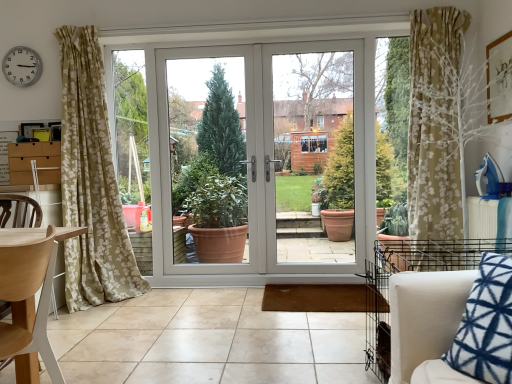
At what (x,y) coordinates should I click in order to perform the action: click on white plastic door at center, the first window frame positioned from the right. Please return your answer as a coordinate pair (x, y). Image resolution: width=512 pixels, height=384 pixels. Looking at the image, I should click on (313, 156).

In order to click on white plastic door at center, the 2th window frame positioned from the right in this screenshot , I will do `click(212, 152)`.

Describe the element at coordinates (440, 330) in the screenshot. I see `beige fabric armchair at lower right` at that location.

At what (x,y) coordinates should I click in order to perform the action: click on white glossy door at center. Please return your answer as a coordinate pair (x, y). The height and width of the screenshot is (384, 512). Looking at the image, I should click on (267, 152).

Where is `white plastic door at center, arranged as the second window frame when viewed from the left`? This screenshot has width=512, height=384. white plastic door at center, arranged as the second window frame when viewed from the left is located at coordinates (313, 156).

From the image's perspective, is beige fabric armchair at lower right located beneath white glossy door at center?

Indeed, from the image's perspective, beige fabric armchair at lower right is shown beneath white glossy door at center.

From a real-world perspective, is beige fabric armchair at lower right above or below white glossy door at center?

beige fabric armchair at lower right is below white glossy door at center.

Looking at this image, what's the angular difference between beige fabric armchair at lower right and white glossy door at center's facing directions?

89 degrees separate the facing orientations of beige fabric armchair at lower right and white glossy door at center.

Is beige fabric armchair at lower right further to camera compared to white glossy door at center?

That is False.

From a real-world perspective, is white plastic door at center, the 1th window frame in the left-to-right sequence, physically located above or below beige fabric armchair at lower right?

Clearly, from a real-world perspective, white plastic door at center, the 1th window frame in the left-to-right sequence, is above beige fabric armchair at lower right.

Consider the image. Considering the relative sizes of white plastic door at center, the 2th window frame positioned from the right, and beige fabric armchair at lower right in the image provided, is white plastic door at center, the 2th window frame positioned from the right, shorter than beige fabric armchair at lower right?

In fact, white plastic door at center, the 2th window frame positioned from the right, may be taller than beige fabric armchair at lower right.

Is white plastic door at center, the 2th window frame positioned from the right, bigger than beige fabric armchair at lower right?

Incorrect, white plastic door at center, the 2th window frame positioned from the right, is not larger than beige fabric armchair at lower right.

Based on the photo, would you say white plastic door at center, the 2th window frame positioned from the right, is inside or outside beige fabric armchair at lower right?

The correct answer is: outside.

Does beige tile at center turn towards silver metallic clock at upper left?

No, beige tile at center is not oriented towards silver metallic clock at upper left.

Between beige tile at center and silver metallic clock at upper left, which one has smaller size?

silver metallic clock at upper left is smaller.

Which is behind, beige tile at center or silver metallic clock at upper left?

silver metallic clock at upper left is further from the camera.

Between beige tile at center and silver metallic clock at upper left, which one has smaller width?

silver metallic clock at upper left.

Looking at this image, between wooden picture frame at upper right and silver metallic clock at upper left, which one is positioned in front?

wooden picture frame at upper right.

Considering the positions of point (492, 56) and point (7, 56), is point (492, 56) closer or farther from the camera than point (7, 56)?

Point (492, 56).

Can you confirm if wooden picture frame at upper right is taller than silver metallic clock at upper left?

Yes, wooden picture frame at upper right is taller than silver metallic clock at upper left.

Is wooden picture frame at upper right looking in the opposite direction of silver metallic clock at upper left?

No, wooden picture frame at upper right is not facing away from silver metallic clock at upper left.

At what (x,y) coordinates should I click in order to perform the action: click on armchair lying in front of the beige tile at center. Please return your answer as a coordinate pair (x, y). This screenshot has height=384, width=512. Looking at the image, I should click on (440, 330).

Would you consider beige tile at center to be distant from beige fabric armchair at lower right?

That's right, there is a large distance between beige tile at center and beige fabric armchair at lower right.

Which object is positioned more to the left, beige tile at center or beige fabric armchair at lower right?

Positioned to the left is beige tile at center.

Considering the sizes of objects light wood chair at left and beige fabric armchair at lower right in the image provided, who is wider, light wood chair at left or beige fabric armchair at lower right?

Wider between the two is beige fabric armchair at lower right.

Which of these two, light wood chair at left or beige fabric armchair at lower right, stands shorter?

With less height is beige fabric armchair at lower right.

Where is `the 2nd window frame to the left of the beige fabric armchair at lower right, counting from the anchor's position`? Image resolution: width=512 pixels, height=384 pixels. the 2nd window frame to the left of the beige fabric armchair at lower right, counting from the anchor's position is located at coordinates (212, 152).

Considering the relative positions of beige fabric armchair at lower right and white plastic door at center, the 2th window frame positioned from the right, in the image provided, is beige fabric armchair at lower right to the right of white plastic door at center, the 2th window frame positioned from the right, from the viewer's perspective?

Yes.

Considering the points (412, 352) and (159, 86), which point is behind, point (412, 352) or point (159, 86)?

The point (159, 86) is farther from the camera.

Considering the relative sizes of beige fabric armchair at lower right and white plastic door at center, the 2th window frame positioned from the right, in the image provided, is beige fabric armchair at lower right thinner than white plastic door at center, the 2th window frame positioned from the right,?

No, beige fabric armchair at lower right is not thinner than white plastic door at center, the 2th window frame positioned from the right.

Locate an element on the screen. Image resolution: width=512 pixels, height=384 pixels. armchair below the white glossy door at center (from the image's perspective) is located at coordinates (440, 330).

Starting from the beige fabric armchair at lower right, which window frame is the 2nd one behind? Please provide its 2D coordinates.

[(212, 152)]

From the image, which object appears to be nearer to wooden picture frame at upper right, silver metallic clock at upper left or white plastic door at center, the first window frame positioned from the right?

white plastic door at center, the first window frame positioned from the right.

Considering their positions, is light wood chair at left positioned closer to white plastic door at center, the 1th window frame in the left-to-right sequence, than silver metallic clock at upper left?

Among the two, silver metallic clock at upper left is located nearer to white plastic door at center, the 1th window frame in the left-to-right sequence.

Which object lies further to the anchor point beige fabric armchair at lower right, white glossy door at center or white plastic door at center, arranged as the second window frame when viewed from the left?

The object further to beige fabric armchair at lower right is white glossy door at center.

Considering their positions, is white glossy door at center positioned closer to beige fabric armchair at lower right than beige tile at center?

→ beige tile at center is closer to beige fabric armchair at lower right.

Based on their spatial positions, is silver metallic clock at upper left or beige tile at center further from beige fabric armchair at lower right?

silver metallic clock at upper left.

When comparing their distances from silver metallic clock at upper left, does beige fabric armchair at lower right or white plastic door at center, the 2th window frame positioned from the right, seem closer?

Among the two, white plastic door at center, the 2th window frame positioned from the right, is located nearer to silver metallic clock at upper left.

From the image, which object appears to be nearer to silver metallic clock at upper left, white glossy door at center or beige tile at center?

white glossy door at center.

From the image, which object appears to be nearer to wooden picture frame at upper right, light wood chair at left or beige fabric armchair at lower right?

Among the two, beige fabric armchair at lower right is located nearer to wooden picture frame at upper right.

At what (x,y) coordinates should I click in order to perform the action: click on door located between silver metallic clock at upper left and beige fabric armchair at lower right in the left-right direction. Please return your answer as a coordinate pair (x, y). Looking at the image, I should click on (267, 152).

Where is `picture frame located between beige fabric armchair at lower right and white glossy door at center in the depth direction`? This screenshot has height=384, width=512. picture frame located between beige fabric armchair at lower right and white glossy door at center in the depth direction is located at coordinates (499, 78).

At what (x,y) coordinates should I click in order to perform the action: click on window frame between beige fabric armchair at lower right and white plastic door at center, the 1th window frame in the left-to-right sequence, along the z-axis. Please return your answer as a coordinate pair (x, y). This screenshot has height=384, width=512. Looking at the image, I should click on (313, 156).

I want to click on window frame between white glossy door at center and wooden picture frame at upper right, so click(313, 156).